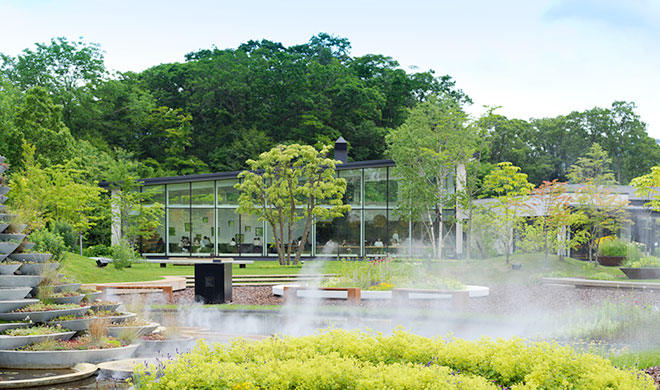
Find the location of a particular element. people sitting at tables inside glass wall is located at coordinates (301, 237), (396, 235).